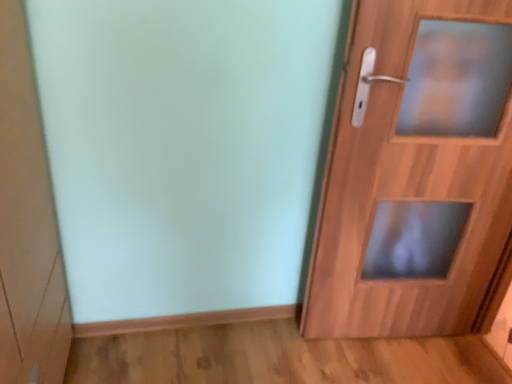
Question: Looking at their shapes, would you say matte white cabinet at left is wider or thinner than wooden door at right?

Choices:
 (A) thin
 (B) wide

Answer: (B)

Question: From a real-world perspective, is matte white cabinet at left physically located above or below wooden door at right?

Choices:
 (A) below
 (B) above

Answer: (A)

Question: Is matte white cabinet at left inside the boundaries of wooden door at right, or outside?

Choices:
 (A) outside
 (B) inside

Answer: (A)

Question: Is wooden door at right wider or thinner than matte white cabinet at left?

Choices:
 (A) thin
 (B) wide

Answer: (A)

Question: In terms of size, does wooden door at right appear bigger or smaller than matte white cabinet at left?

Choices:
 (A) big
 (B) small

Answer: (A)

Question: Do you think wooden door at right is within matte white cabinet at left, or outside of it?

Choices:
 (A) outside
 (B) inside

Answer: (A)

Question: In terms of height, does wooden door at right look taller or shorter compared to matte white cabinet at left?

Choices:
 (A) short
 (B) tall

Answer: (B)